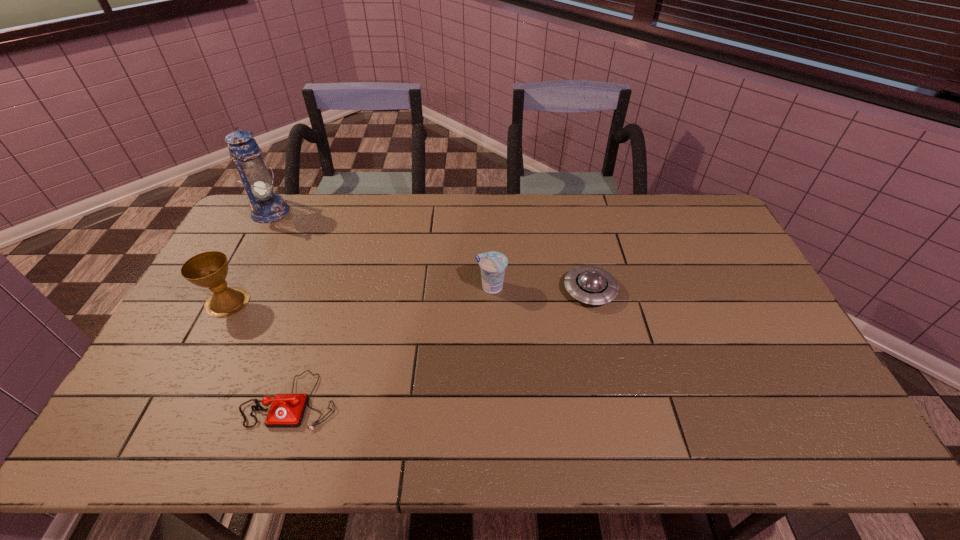
Find the location of a particular element. The image size is (960, 540). the farthest object is located at coordinates (266, 206).

Locate an element on the screen. This screenshot has height=540, width=960. lantern is located at coordinates [x=266, y=206].

Locate an element on the screen. The width and height of the screenshot is (960, 540). chalice is located at coordinates (209, 269).

Identify the location of yogurt. (492, 264).

I want to click on the second object from right to left, so click(x=492, y=264).

Find the location of a particular element. Image resolution: width=960 pixels, height=540 pixels. the rightmost object is located at coordinates (592, 285).

Locate an element on the screen. the third object from left to right is located at coordinates (287, 410).

Locate an element on the screen. The width and height of the screenshot is (960, 540). telephone is located at coordinates (287, 410).

At what (x,y) coordinates should I click in order to perform the action: click on free location located on the front-facing side of the lantern. Please return your answer as a coordinate pair (x, y). This screenshot has width=960, height=540. Looking at the image, I should click on (375, 212).

What are the coordinates of `free space located 0.110m on the right of the chalice` in the screenshot? It's located at (285, 302).